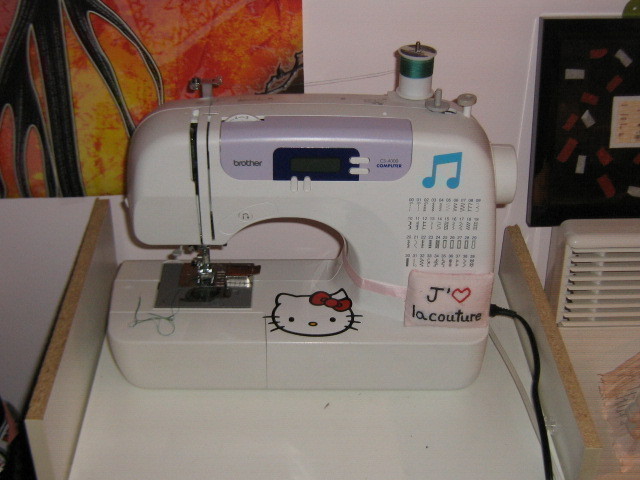
The height and width of the screenshot is (480, 640). What are the coordinates of `white work surface` in the screenshot? It's located at (276, 414).